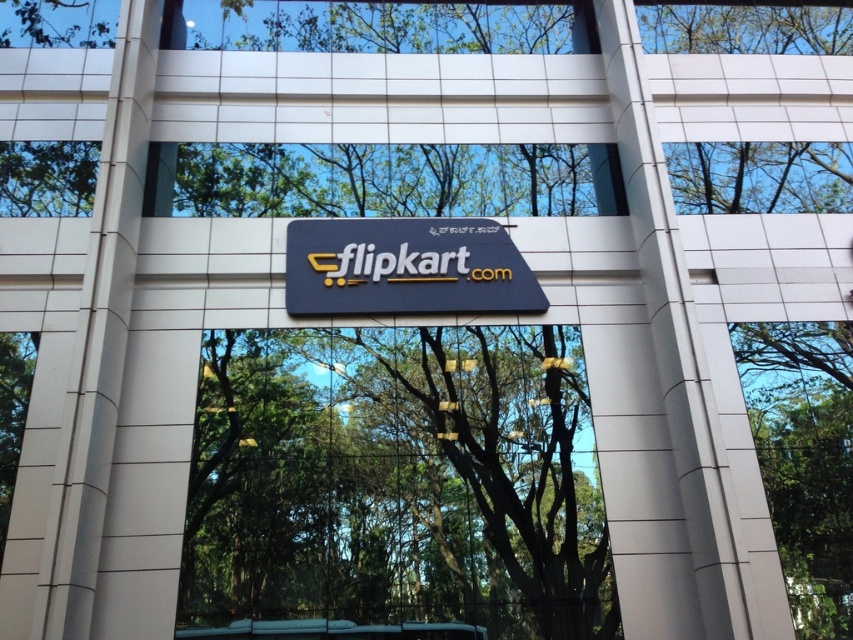
Which is behind, point (218, 339) or point (471, 253)?

The point (471, 253) is more distant.

Between green leafy tree at center and matte black sign at center, which one is positioned lower?

Positioned lower is green leafy tree at center.

Is point (259, 595) farther from camera compared to point (440, 240)?

No, it is not.

Image resolution: width=853 pixels, height=640 pixels. I want to click on green leafy tree at center, so click(x=397, y=483).